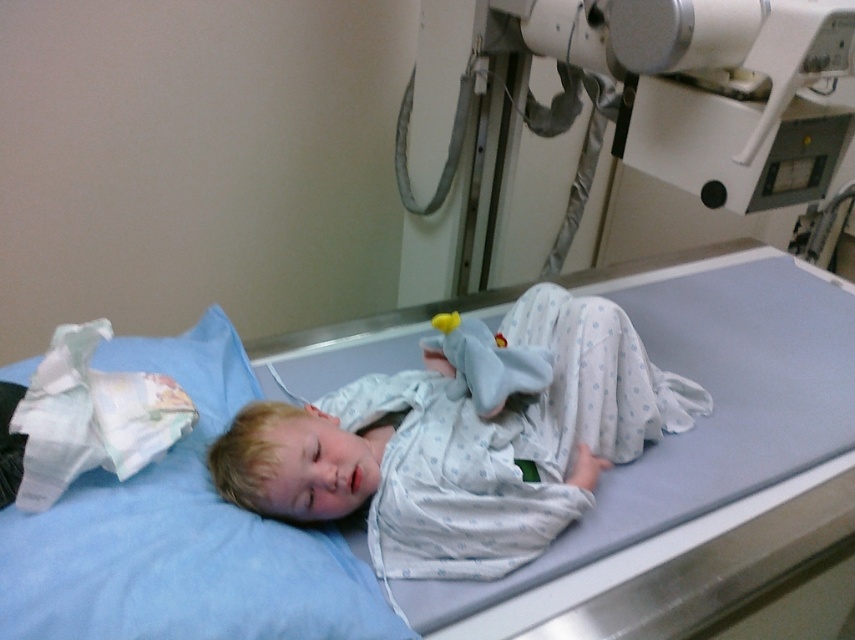
Question: Which point is farther to the camera?

Choices:
 (A) (413, 104)
 (B) (233, 426)
 (C) (833, 324)
 (D) (69, 628)

Answer: (A)

Question: Does metallic gray machine at upper right have a smaller size compared to white cotton pajamas at center?

Choices:
 (A) no
 (B) yes

Answer: (A)

Question: Which object is the closest to the metallic gray machine at upper right?

Choices:
 (A) light blue fabric at center
 (B) white cotton pajamas at center
 (C) blue fabric pillow at upper left

Answer: (B)

Question: Does white cotton pajamas at center have a larger size compared to blue fabric pillow at upper left?

Choices:
 (A) yes
 (B) no

Answer: (B)

Question: Considering the real-world distances, which object is closest to the light blue fabric at center?

Choices:
 (A) white cotton pajamas at center
 (B) metallic gray machine at upper right

Answer: (A)

Question: Does light blue fabric at center appear over blue fabric pillow at upper left?

Choices:
 (A) yes
 (B) no

Answer: (A)